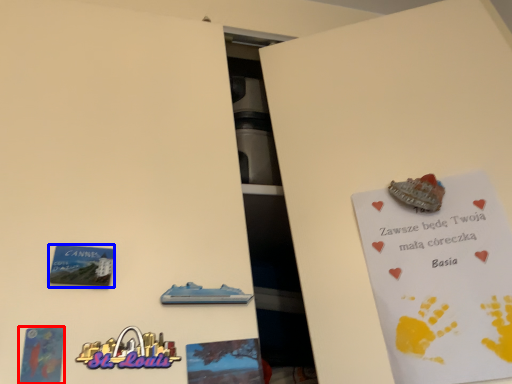
Question: Which point is further to the camera, postcard (highlighted by a red box) or plaque (highlighted by a blue box)?

Choices:
 (A) postcard
 (B) plaque

Answer: (B)